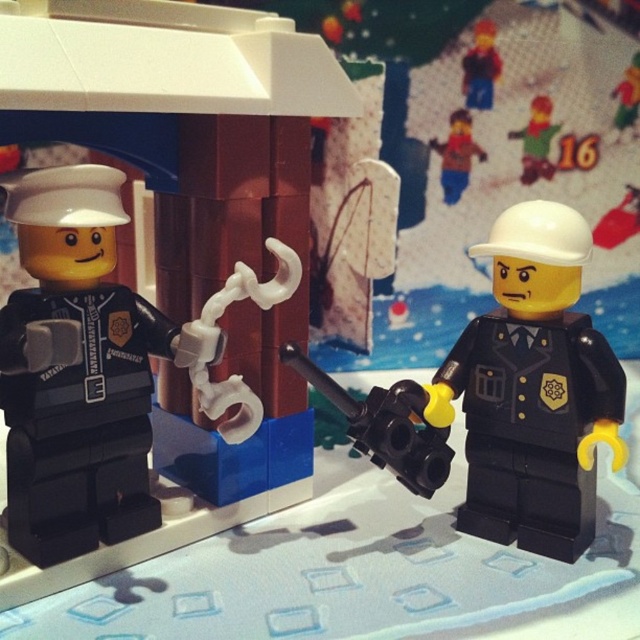
Is matte black police officer at left bigger than matte brown figure at upper center?

Yes, matte black police officer at left is bigger than matte brown figure at upper center.

Does matte black police officer at left appear over matte brown figure at upper center?

Actually, matte black police officer at left is below matte brown figure at upper center.

Which is behind, point (124, 323) or point (470, 118)?

Point (470, 118)

Identify the location of matte black police officer at left. (156, 259).

Who is more distant from viewer, (461, 179) or (545, 160)?

The point (545, 160) is more distant.

Is matte brown figure at upper center below green matte figure at upper right?

Correct, matte brown figure at upper center is located below green matte figure at upper right.

Between point (461, 170) and point (532, 131), which one is positioned in front?

Point (461, 170) is in front.

At what (x,y) coordinates should I click in order to perform the action: click on matte brown figure at upper center. Please return your answer as a coordinate pair (x, y). The image size is (640, 640). Looking at the image, I should click on (456, 156).

Measure the distance between point (x=234, y=253) and camera.

A distance of 93.02 centimeters exists between point (x=234, y=253) and camera.

Which of these two, matte black police officer at left or green matte figure at upper right, stands taller?

matte black police officer at left is taller.

Which is behind, point (109, 532) or point (529, 122)?

Positioned behind is point (529, 122).

Locate an element on the screen. The height and width of the screenshot is (640, 640). matte black police officer at left is located at coordinates (156, 259).